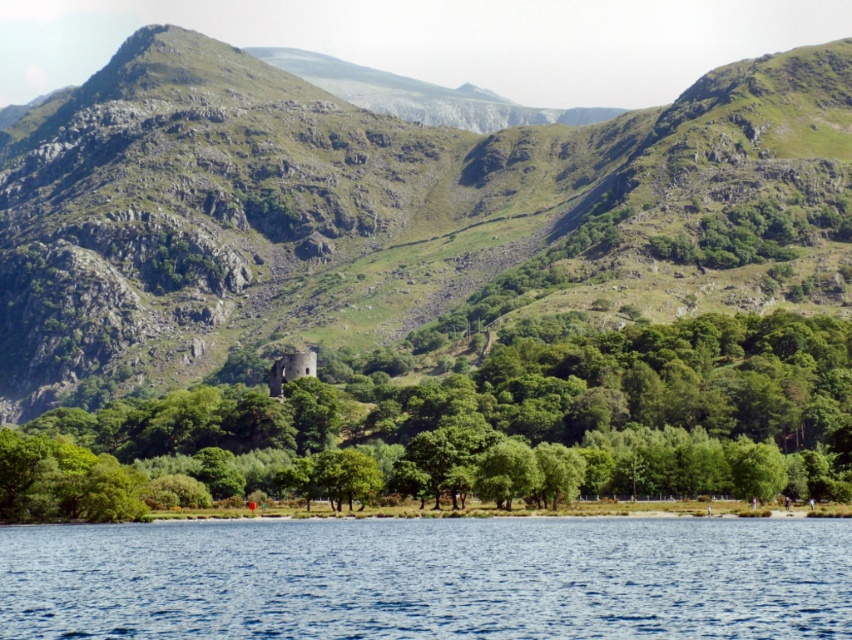
You are a photographer planning to capture the blue liquid water at lower center and the green leafy tree at center in a single frame. Based on their sizes in the scene, which object should you focus on to ensure both are clearly visible without cropping?

The blue liquid water at lower center has a smaller size compared to the green leafy tree at center. To ensure both are clearly visible without cropping, focus on the larger object, the green leafy tree at center, and position the camera so that the smaller blue liquid water at lower center is also within the frame.

You are a hiker planning to take a photo of the green leafy tree at center and the green rocky mountain at center from a vantage point. Which object should you position yourself closer to in order to capture both in a single frame?

To capture both the green leafy tree at center and the green rocky mountain at center in a single frame, you should position yourself closer to the green leafy tree at center. Since the green rocky mountain at center is located above the green leafy tree at center, moving closer to the tree will help include the mountain in the background of the photo.

You are standing at the camera position observing the serene landscape. You want to walk directly towards the blue liquid water at lower center. How far will you have to walk to reach it?

The distance of blue liquid water at lower center from camera is 108.88 meters, so you will have to walk approximately 108.88 meters to reach it.